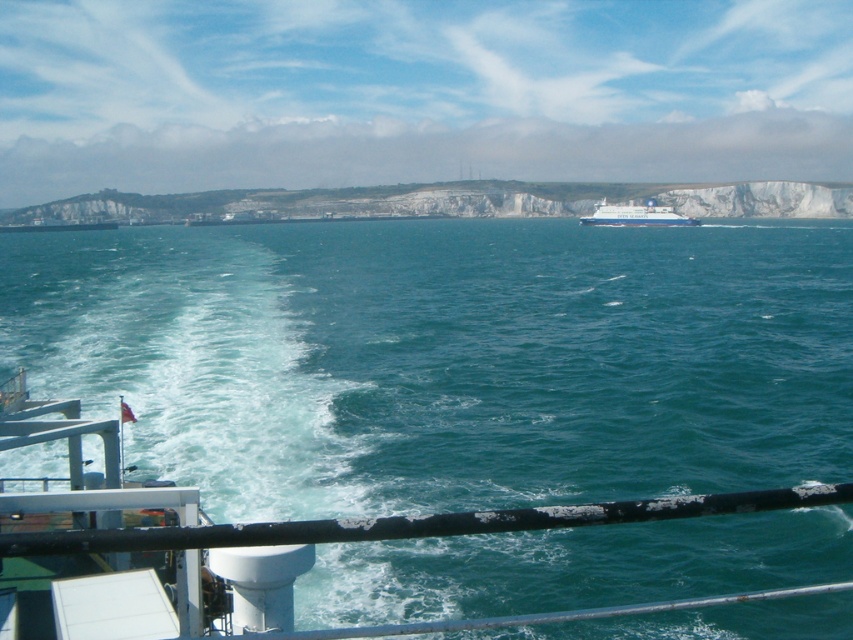
Can you confirm if clear blue water at center is positioned to the right of white glossy cruise ship at center?

Incorrect, clear blue water at center is not on the right side of white glossy cruise ship at center.

How much distance is there between clear blue water at center and white glossy cruise ship at center?

clear blue water at center is 51.90 meters from white glossy cruise ship at center.

Where is `clear blue water at center`? The height and width of the screenshot is (640, 853). clear blue water at center is located at coordinates (445, 358).